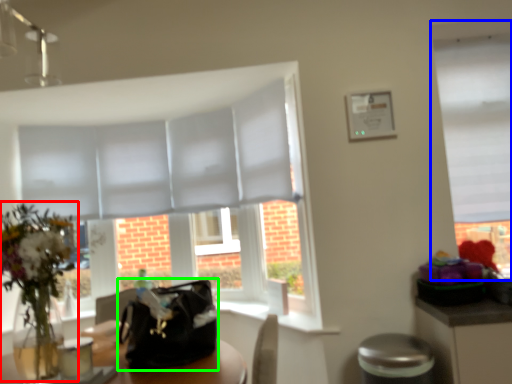
Question: Which object is positioned closest to floral arrangement (highlighted by a red box)? Select from window (highlighted by a blue box) and handbag (highlighted by a green box).

Choices:
 (A) window
 (B) handbag

Answer: (B)